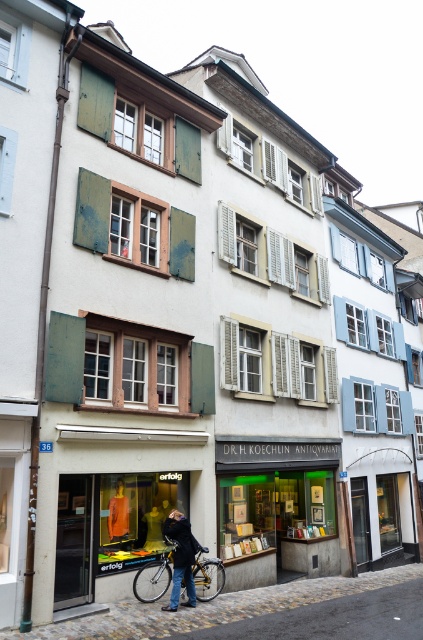
Question: Does silver metallic bicycle at center have a lesser width compared to dark blue leather jacket at center?

Choices:
 (A) yes
 (B) no

Answer: (A)

Question: Which of the following is the closest to the observer?

Choices:
 (A) dark blue leather jacket at center
 (B) silver metallic bicycle at center

Answer: (A)

Question: Which object is farther from the camera taking this photo?

Choices:
 (A) dark blue leather jacket at center
 (B) silver metallic bicycle at center

Answer: (B)

Question: Which point appears farthest from the camera in this image?

Choices:
 (A) (165, 531)
 (B) (134, 593)

Answer: (A)

Question: Does silver metallic bicycle at center have a larger size compared to dark blue leather jacket at center?

Choices:
 (A) yes
 (B) no

Answer: (A)

Question: Is the position of silver metallic bicycle at center more distant than that of dark blue leather jacket at center?

Choices:
 (A) no
 (B) yes

Answer: (B)